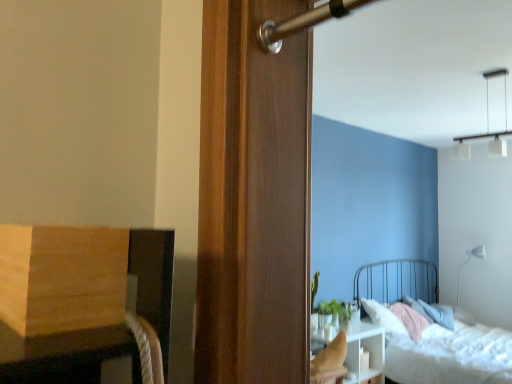
I want to click on vacant region above white glass pendant lights at upper right, which is the first light fixture in top-to-bottom order (from a real-world perspective), so (480, 75).